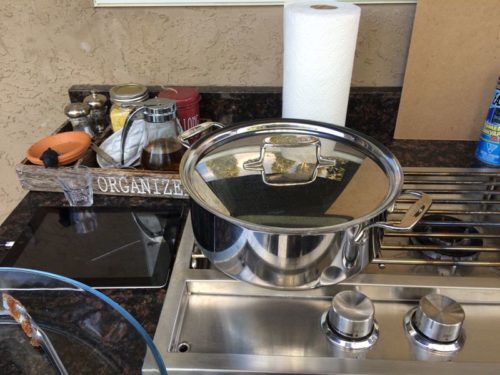
In order to click on charger in this screenshot , I will do `click(10, 245)`.